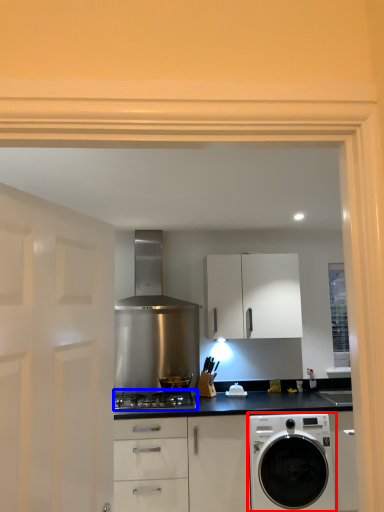
Question: Which object is closer to the camera taking this photo, washing machine (highlighted by a red box) or gas stove (highlighted by a blue box)?

Choices:
 (A) washing machine
 (B) gas stove

Answer: (A)